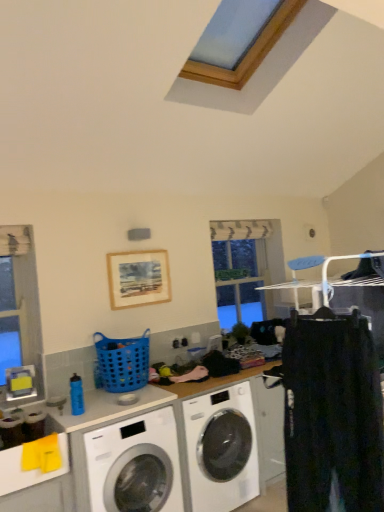
Question: Is black cotton pants at right bigger than white glossy washing machine at center, the 2th washing machine positioned from the left?

Choices:
 (A) yes
 (B) no

Answer: (B)

Question: Is black cotton pants at right oriented away from white glossy washing machine at center, the 2th washing machine positioned from the left?

Choices:
 (A) no
 (B) yes

Answer: (A)

Question: Does black cotton pants at right contain white glossy washing machine at center, the first washing machine in the right-to-left sequence?

Choices:
 (A) yes
 (B) no

Answer: (B)

Question: Is black cotton pants at right next to white glossy washing machine at center, the 2th washing machine positioned from the left, and touching it?

Choices:
 (A) yes
 (B) no

Answer: (B)

Question: Can you confirm if black cotton pants at right is smaller than white glossy washing machine at center, the first washing machine in the right-to-left sequence?

Choices:
 (A) no
 (B) yes

Answer: (B)

Question: Does black cotton pants at right have a greater height compared to white glossy washing machine at center, the first washing machine in the right-to-left sequence?

Choices:
 (A) no
 (B) yes

Answer: (B)

Question: Is wooden picture frame at upper center located within white glossy washing machine at center, the first washing machine in the right-to-left sequence?

Choices:
 (A) no
 (B) yes

Answer: (A)

Question: From a real-world perspective, is white glossy washing machine at center, the first washing machine in the right-to-left sequence, located higher than wooden picture frame at upper center?

Choices:
 (A) no
 (B) yes

Answer: (A)

Question: Is white glossy washing machine at center, the 2th washing machine positioned from the left, positioned before wooden picture frame at upper center?

Choices:
 (A) no
 (B) yes

Answer: (B)

Question: Are white glossy washing machine at center, the first washing machine in the right-to-left sequence, and wooden picture frame at upper center beside each other?

Choices:
 (A) yes
 (B) no

Answer: (B)

Question: Does white glossy washing machine at center, the 2th washing machine positioned from the left, have a greater height compared to wooden picture frame at upper center?

Choices:
 (A) no
 (B) yes

Answer: (B)

Question: From a real-world perspective, is white glossy washing machine at center, the 2th washing machine positioned from the left, positioned under wooden picture frame at upper center based on gravity?

Choices:
 (A) no
 (B) yes

Answer: (B)

Question: Is the position of wooden picture frame at upper center more distant than that of blue plastic basket at center?

Choices:
 (A) no
 (B) yes

Answer: (B)